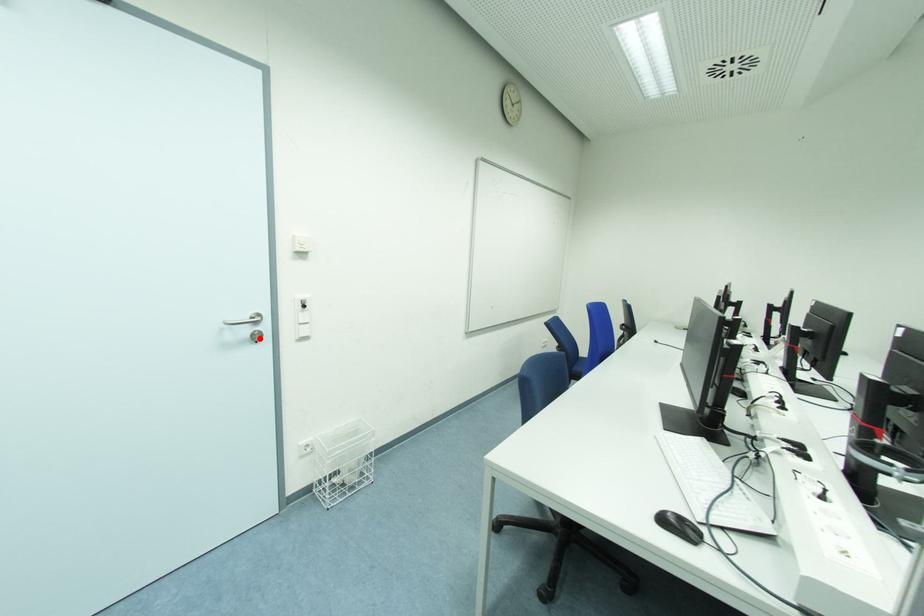
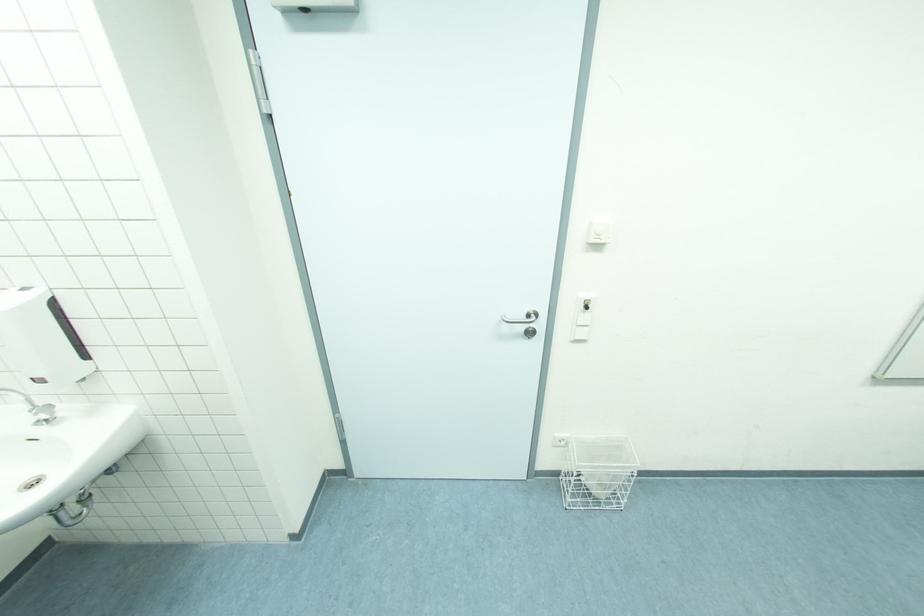
Where in the second image is the point corresponding to the highlighted location from the first image?

(532, 334)